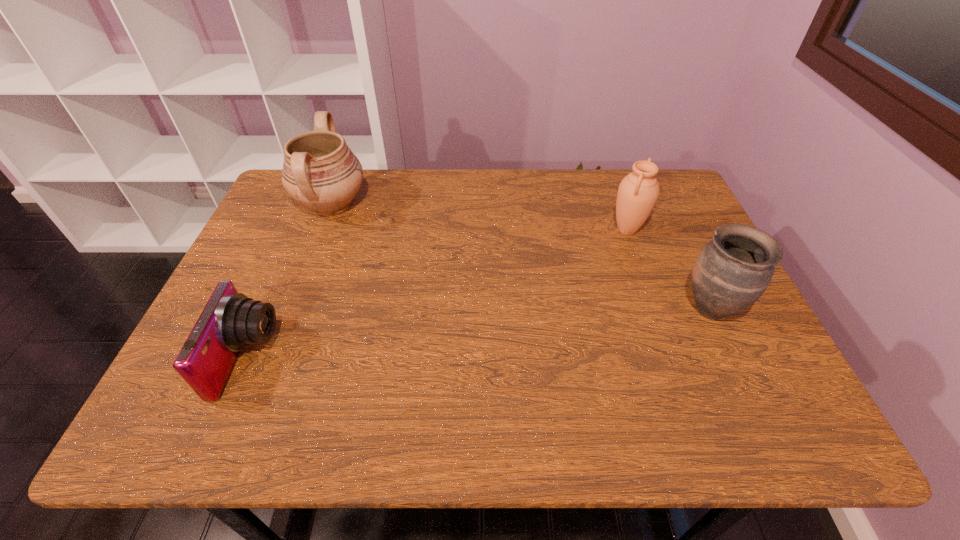
Where is `object identified as the second closest to the rightmost urn`? The height and width of the screenshot is (540, 960). object identified as the second closest to the rightmost urn is located at coordinates (320, 172).

Identify which object is the second nearest to the second object from right to left. Please provide its 2D coordinates. Your answer should be formatted as a tuple, i.e. [(x, y)], where the tuple contains the x and y coordinates of a point satisfying the conditions above.

[(320, 172)]

Select which urn appears as the second closest to the camera. Please provide its 2D coordinates. Your answer should be formatted as a tuple, i.e. [(x, y)], where the tuple contains the x and y coordinates of a point satisfying the conditions above.

[(638, 192)]

Select which urn is the closest to the nearest urn. Please provide its 2D coordinates. Your answer should be formatted as a tuple, i.e. [(x, y)], where the tuple contains the x and y coordinates of a point satisfying the conditions above.

[(638, 192)]

Image resolution: width=960 pixels, height=540 pixels. What are the coordinates of `free space that satisfies the following two spatial constraints: 1. on the front-facing side of the leftmost urn; 2. on the left side of the rightmost urn` in the screenshot? It's located at (292, 309).

I want to click on free space that satisfies the following two spatial constraints: 1. on the front-facing side of the leftmost urn; 2. on the left side of the second urn from right to left, so click(322, 230).

This screenshot has width=960, height=540. Find the location of `vacant area that satisfies the following two spatial constraints: 1. on the front-facing side of the leftmost urn; 2. on the left side of the rightmost urn`. vacant area that satisfies the following two spatial constraints: 1. on the front-facing side of the leftmost urn; 2. on the left side of the rightmost urn is located at coordinates (292, 309).

This screenshot has height=540, width=960. In order to click on free space in the image that satisfies the following two spatial constraints: 1. on the front-facing side of the leftmost urn; 2. on the right side of the second object from right to left in this screenshot , I will do coord(322,230).

You are a GUI agent. You are given a task and a screenshot of the screen. Output one action in this format:
    pyautogui.click(x=<x>, y=<y>)
    Task: Click on the vacant area in the image that satisfies the following two spatial constraints: 1. on the front-facing side of the leftmost urn; 2. on the right side of the rightmost object
    The height and width of the screenshot is (540, 960).
    Given the screenshot: What is the action you would take?
    pyautogui.click(x=292, y=309)

This screenshot has height=540, width=960. What are the coordinates of `free region that satisfies the following two spatial constraints: 1. on the front side of the rightmost object; 2. on the left side of the second urn from right to left` in the screenshot? It's located at point(656,309).